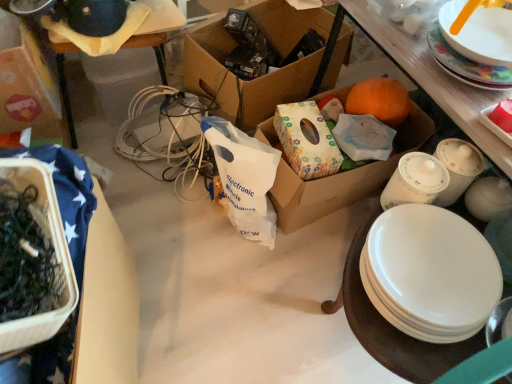
You are a GUI agent. You are given a task and a screenshot of the screen. Output one action in this format:
    pyautogui.click(x=<x>, y=<y>)
    Task: Click on the vacant space to the left of matte white platter at upper right
    The image size is (512, 384).
    Given the screenshot: What is the action you would take?
    pyautogui.click(x=455, y=106)